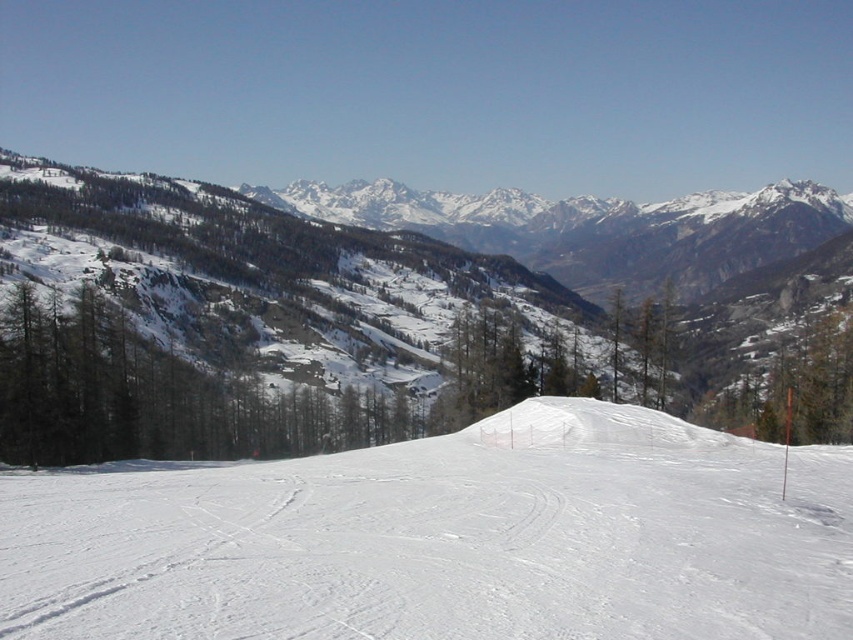
You are a skier planning to descend the slope. The point at coordinates point [444,538] marks the center of the white snow ski slope at center. If you start from the top of the slope, which direction should you aim to stay on the slope?

The white snow ski slope at center is represented by point [444,538]. To stay on the slope, aim towards the center point [444,538] as you descend from the top.

You are a skier planning to descend the white snow ski slope at center. You notice a green matte tree at right nearby. Which object is taller?

The green matte tree at right is taller than the white snow ski slope at center.